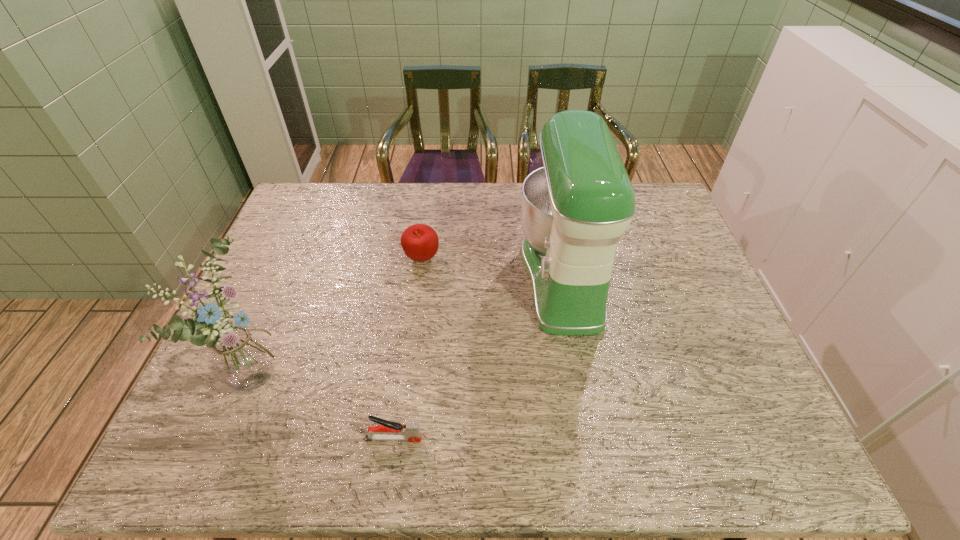
This screenshot has width=960, height=540. What are the coordinates of `blank region between the mixer and the apple` in the screenshot? It's located at (492, 268).

The image size is (960, 540). Identify the location of vacant area between the mixer and the apple. (492, 268).

At what (x,y) coordinates should I click in order to perform the action: click on free point between the nearest object and the bouquet. Please return your answer as a coordinate pair (x, y). This screenshot has width=960, height=540. Looking at the image, I should click on (326, 404).

Where is `free space between the nearest object and the rightmost object`? Image resolution: width=960 pixels, height=540 pixels. free space between the nearest object and the rightmost object is located at coordinates coord(478,357).

This screenshot has height=540, width=960. I want to click on vacant space that's between the apple and the bouquet, so click(x=341, y=315).

This screenshot has height=540, width=960. Identify the location of free area in between the rightmost object and the apple. (492, 268).

Locate an element on the screen. Image resolution: width=960 pixels, height=540 pixels. free spot between the rightmost object and the apple is located at coordinates (492, 268).

Find the location of a particular element. Image resolution: width=960 pixels, height=540 pixels. free space between the apple and the rightmost object is located at coordinates (492, 268).

You are a GUI agent. You are given a task and a screenshot of the screen. Output one action in this format:
    pyautogui.click(x=<x>, y=<y>)
    Task: Click on the object that stands as the second closest to the leftmost object
    Image resolution: width=960 pixels, height=540 pixels.
    Given the screenshot: What is the action you would take?
    [420, 242]

Identify the location of object that is the second closest to the stapler. The image size is (960, 540). (574, 209).